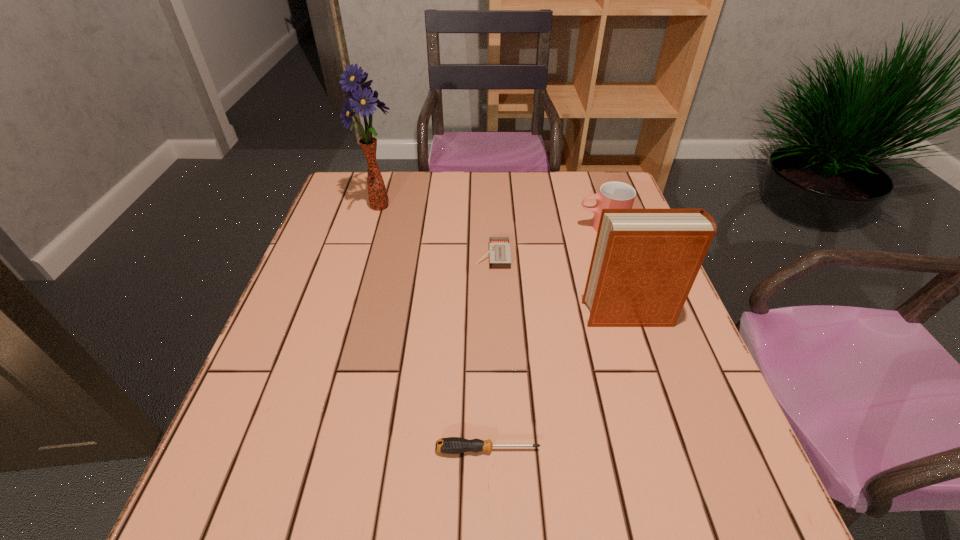
The width and height of the screenshot is (960, 540). In order to click on free space between the matchbox and the leftmost object in this screenshot , I will do `click(437, 232)`.

This screenshot has height=540, width=960. What are the coordinates of `vacant area that lies between the hardback book and the matchbox` in the screenshot? It's located at (561, 286).

The height and width of the screenshot is (540, 960). Find the location of `vacant region between the screwdriver and the hardback book`. vacant region between the screwdriver and the hardback book is located at coordinates (559, 382).

You are a GUI agent. You are given a task and a screenshot of the screen. Output one action in this format:
    pyautogui.click(x=<x>, y=<y>)
    Task: Click on the free space between the matchbox and the nearest object
    The height and width of the screenshot is (540, 960).
    Given the screenshot: What is the action you would take?
    pyautogui.click(x=491, y=353)

Identify the location of vacant space in between the third tallest object and the flower arrangement. This screenshot has height=540, width=960. (492, 217).

What are the coordinates of `the fourth closest object to the fourth shortest object` in the screenshot? It's located at pyautogui.click(x=363, y=99).

Choose which object is the fourth nearest neighbor to the tallest object. Please provide its 2D coordinates. Your answer should be formatted as a tuple, i.e. [(x, y)], where the tuple contains the x and y coordinates of a point satisfying the conditions above.

[(452, 445)]

Image resolution: width=960 pixels, height=540 pixels. What are the coordinates of `free spot that satisfies the following two spatial constraints: 1. on the front side of the tallest object; 2. on the side of the third tallest object with the handle` in the screenshot? It's located at (375, 227).

This screenshot has width=960, height=540. Find the location of `free point that satisfies the following two spatial constraints: 1. on the open cover of the second nearest object; 2. on the front side of the nearest object`. free point that satisfies the following two spatial constraints: 1. on the open cover of the second nearest object; 2. on the front side of the nearest object is located at coordinates pos(674,449).